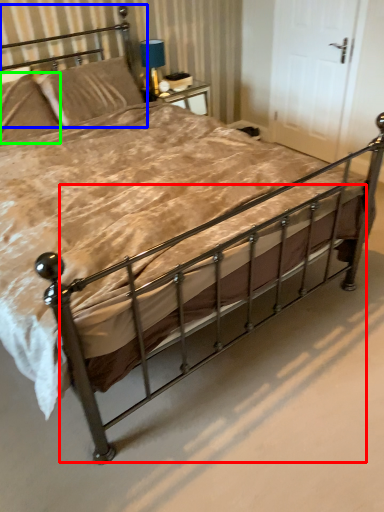
Question: Considering the real-world distances, which object is farthest from balustrade (highlighted by a red box)? headboard (highlighted by a blue box) or pillow (highlighted by a green box)?

Choices:
 (A) headboard
 (B) pillow

Answer: (A)